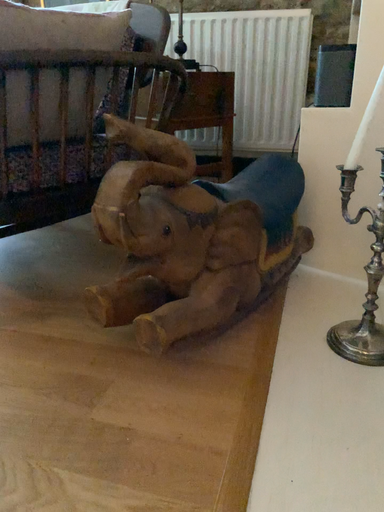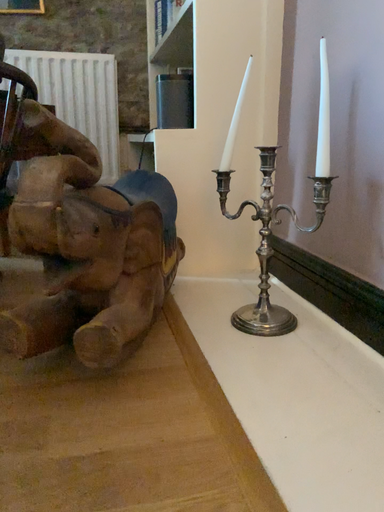
Question: Which way did the camera rotate in the video?

Choices:
 (A) rotated upward
 (B) rotated downward

Answer: (A)